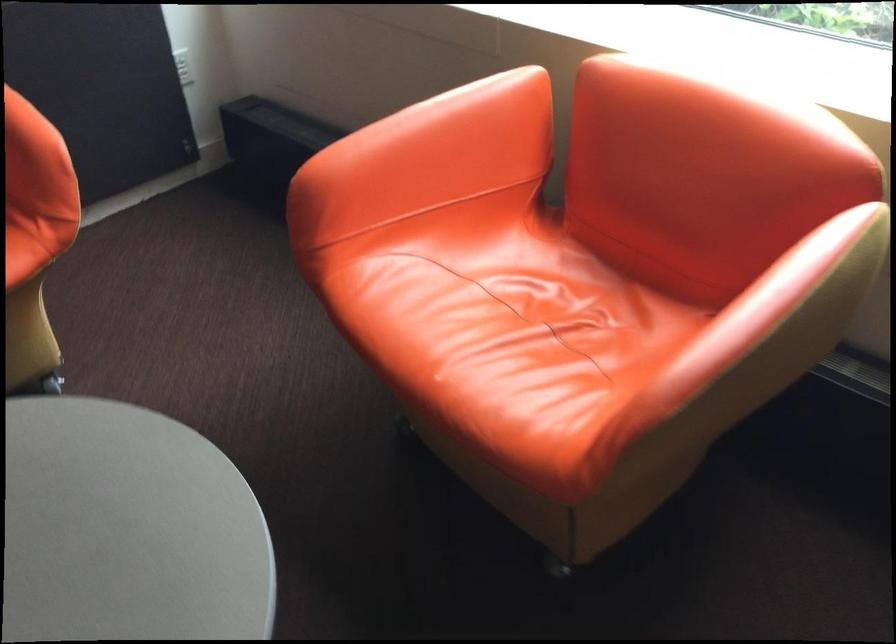
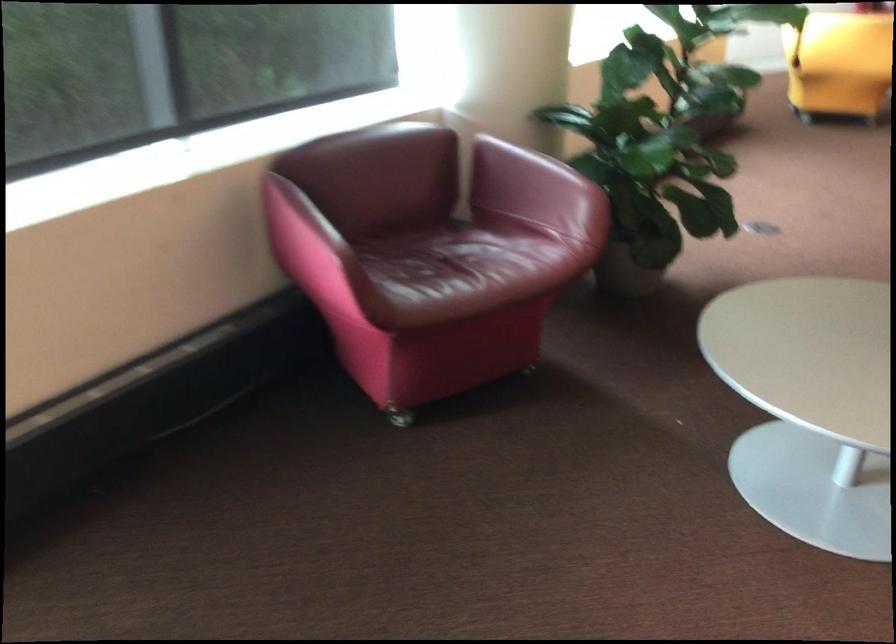
The images are taken continuously from a first-person perspective. In which direction is your viewpoint rotating?

The rotation direction of the camera is right-down.